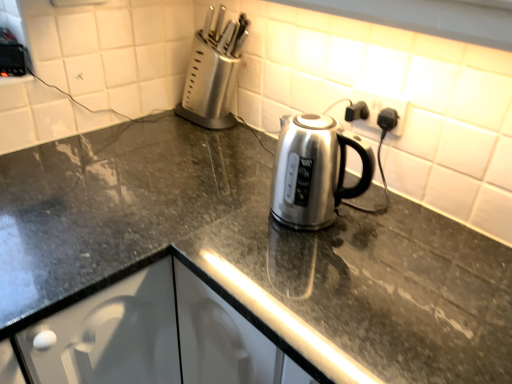
You are a GUI agent. You are given a task and a screenshot of the screen. Output one action in this format:
    pyautogui.click(x=<x>, y=<y>)
    Task: Click on the free point below satin silver knife block at upper left (from a real-world perspective)
    The width and height of the screenshot is (512, 384).
    Given the screenshot: What is the action you would take?
    pyautogui.click(x=209, y=128)